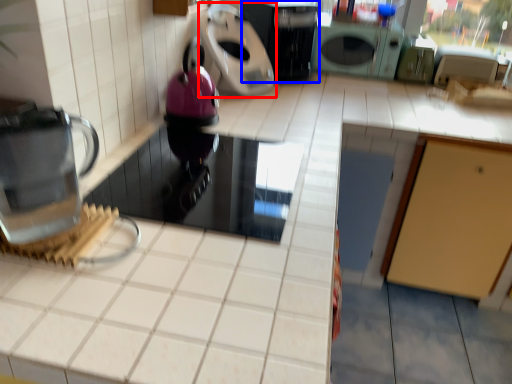
Question: Which of the following is the closest to the observer, kitchen appliance (highlighted by a red box) or kitchen appliance (highlighted by a blue box)?

Choices:
 (A) kitchen appliance
 (B) kitchen appliance

Answer: (A)